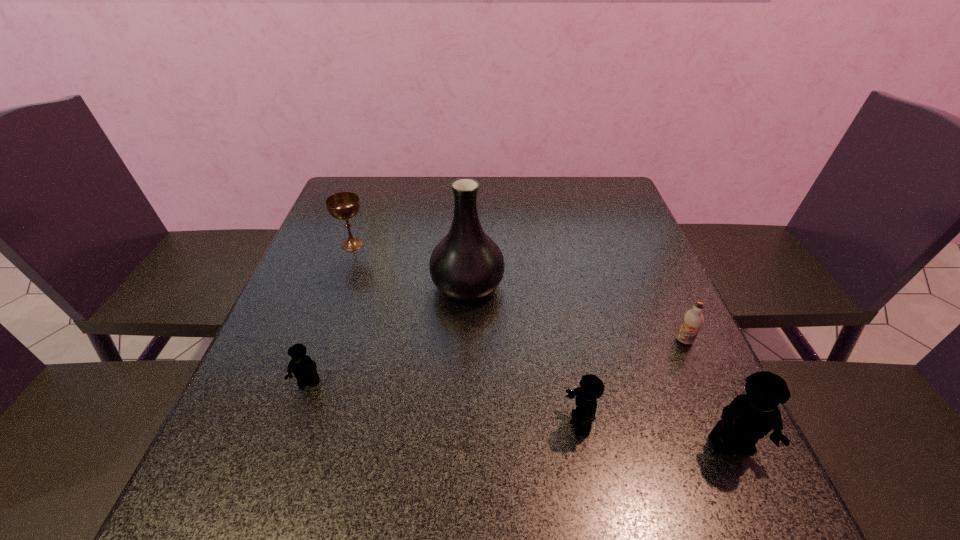
Locate an element on the screen. Image resolution: width=960 pixels, height=540 pixels. empty space that is in between the farthest object and the tallest Lego is located at coordinates [x=541, y=345].

The image size is (960, 540). Identify the location of free area in between the rightmost Lego and the chocolate milk. (708, 394).

Locate an element on the screen. The width and height of the screenshot is (960, 540). vacant area that lies between the vase and the farthest object is located at coordinates (410, 265).

Locate an element on the screen. The image size is (960, 540). vacant region between the rightmost Lego and the tallest object is located at coordinates (599, 366).

I want to click on free space between the tallest Lego and the leftmost Lego, so click(x=520, y=415).

This screenshot has height=540, width=960. I want to click on vacant point located between the second tallest Lego and the tallest Lego, so click(655, 435).

Where is `free area in between the fourth object from right to left and the tallest Lego`? free area in between the fourth object from right to left and the tallest Lego is located at coordinates (599, 366).

Image resolution: width=960 pixels, height=540 pixels. I want to click on free spot between the fourth nearest object and the farthest object, so click(518, 292).

Locate which object is the closest to the vase. Please provide its 2D coordinates. Your answer should be formatted as a tuple, i.e. [(x, y)], where the tuple contains the x and y coordinates of a point satisfying the conditions above.

[(344, 205)]

Locate an element on the screen. The image size is (960, 540). object that ranks as the second closest to the second farthest object is located at coordinates (304, 369).